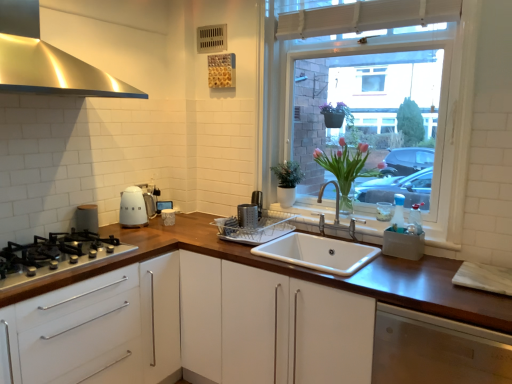
Question: From a real-world perspective, is silver metallic grater at center, the third appliance in the left-to-right sequence, positioned over matte white kettle at left, the second appliance from the left, based on gravity?

Choices:
 (A) no
 (B) yes

Answer: (A)

Question: Is silver metallic grater at center, which ranks as the 1th appliance in right-to-left order, turned away from matte white kettle at left, the second appliance from the left?

Choices:
 (A) no
 (B) yes

Answer: (A)

Question: Can you confirm if silver metallic grater at center, the third appliance in the left-to-right sequence, is taller than matte white kettle at left, which appears as the 2th appliance when viewed from the right?

Choices:
 (A) no
 (B) yes

Answer: (A)

Question: From the image's perspective, would you say silver metallic grater at center, the third appliance in the left-to-right sequence, is positioned over matte white kettle at left, which appears as the 2th appliance when viewed from the right?

Choices:
 (A) no
 (B) yes

Answer: (A)

Question: Is silver metallic grater at center, the third appliance in the left-to-right sequence, completely or partially outside of matte white kettle at left, which appears as the 2th appliance when viewed from the right?

Choices:
 (A) no
 (B) yes

Answer: (B)

Question: Is silver metallic grater at center, the third appliance in the left-to-right sequence, placed right next to matte white kettle at left, the second appliance from the left?

Choices:
 (A) no
 (B) yes

Answer: (A)

Question: Does white glass window at upper right have a larger size compared to matte white kettle at left, marked as the 1th appliance in a left-to-right arrangement?

Choices:
 (A) no
 (B) yes

Answer: (B)

Question: Is white glass window at upper right thinner than matte white kettle at left, marked as the 1th appliance in a left-to-right arrangement?

Choices:
 (A) yes
 (B) no

Answer: (B)

Question: Is white glass window at upper right outside matte white kettle at left, marked as the 1th appliance in a left-to-right arrangement?

Choices:
 (A) no
 (B) yes

Answer: (B)

Question: Is white glass window at upper right closer to the viewer compared to matte white kettle at left, marked as the 1th appliance in a left-to-right arrangement?

Choices:
 (A) no
 (B) yes

Answer: (B)

Question: From the image's perspective, is white glass window at upper right above matte white kettle at left, marked as the 1th appliance in a left-to-right arrangement?

Choices:
 (A) no
 (B) yes

Answer: (B)

Question: Could you tell me if white glass window at upper right is facing matte white kettle at left, marked as the 1th appliance in a left-to-right arrangement?

Choices:
 (A) yes
 (B) no

Answer: (B)

Question: Is stainless steel range hood at upper left wider than white ceramic sink at center?

Choices:
 (A) no
 (B) yes

Answer: (B)